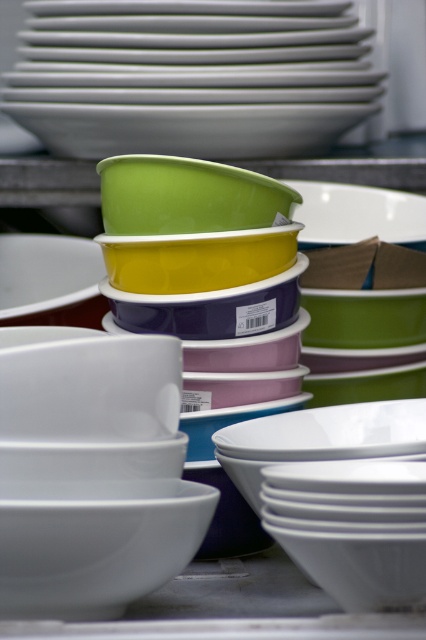
Question: Which point appears closest to the camera in this image?

Choices:
 (A) (63, 179)
 (B) (129, 205)
 (C) (34, 548)

Answer: (C)

Question: Does white glossy bowl at center appear under green glossy bowl at center?

Choices:
 (A) no
 (B) yes

Answer: (B)

Question: Which object is positioned farthest from the white glossy bowl at center?

Choices:
 (A) matte green bowl at upper center
 (B) green glossy bowl at center

Answer: (B)

Question: Does matte green bowl at upper center appear over white glossy bowl at center?

Choices:
 (A) yes
 (B) no

Answer: (A)

Question: Which point is closer to the camera taking this photo?

Choices:
 (A) (115, 189)
 (B) (138, 582)

Answer: (B)

Question: Does matte green bowl at upper center come behind green glossy bowl at center?

Choices:
 (A) yes
 (B) no

Answer: (B)